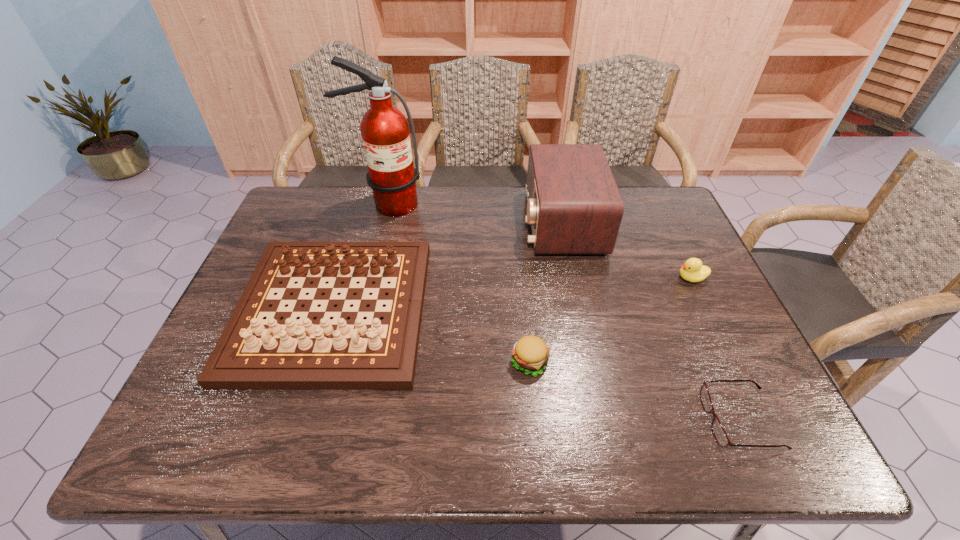
Find the location of a particular element. The image size is (960, 540). vacant area at the near right corner of the desktop is located at coordinates (737, 428).

Where is `empty space that is in between the duckling and the fourth shortest object`? empty space that is in between the duckling and the fourth shortest object is located at coordinates (512, 294).

Identify the location of free space between the radio receiver and the shortest object. click(x=651, y=322).

Identify the location of vacant space that's between the second tallest object and the shortest object. This screenshot has height=540, width=960. (651, 322).

Locate an element on the screen. The width and height of the screenshot is (960, 540). vacant area between the duckling and the spectacles is located at coordinates (716, 349).

I want to click on vacant space that is in between the hamburger and the shortest object, so click(636, 391).

In order to click on vacant space that is in between the tallest object and the hamburger in this screenshot , I will do `click(459, 283)`.

You are a GUI agent. You are given a task and a screenshot of the screen. Output one action in this format:
    pyautogui.click(x=<x>, y=<y>)
    Task: Click on the free space between the fire extinguisher and the second tallest object
    
    Given the screenshot: What is the action you would take?
    pyautogui.click(x=474, y=214)

Image resolution: width=960 pixels, height=540 pixels. Find the location of `vacant area that lies between the hamburger and the spectacles`. vacant area that lies between the hamburger and the spectacles is located at coordinates (636, 391).

The width and height of the screenshot is (960, 540). What are the coordinates of `unoccupied area between the radio receiver and the fire extinguisher` in the screenshot? It's located at (474, 214).